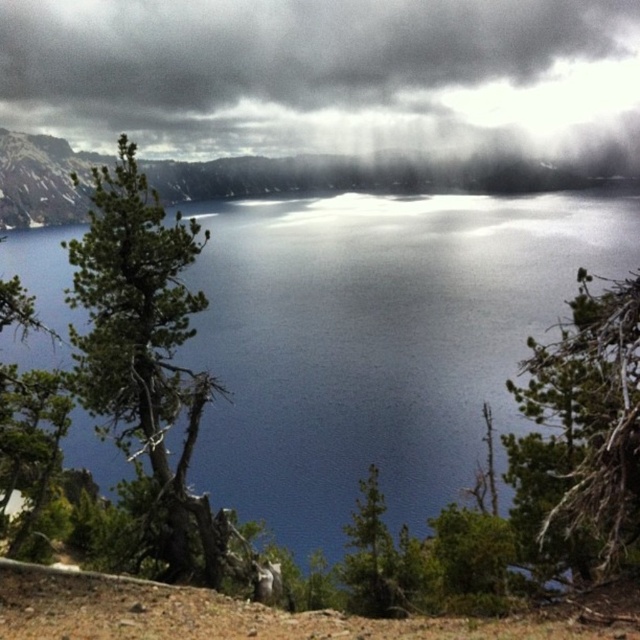
You are standing at the edge of the lake in the image. There is a point marked at coordinates [378,340]. What does this point represent in the scene?

The point at coordinates [378,340] represents the blue reflective water at center, as stated in the Objects Description.